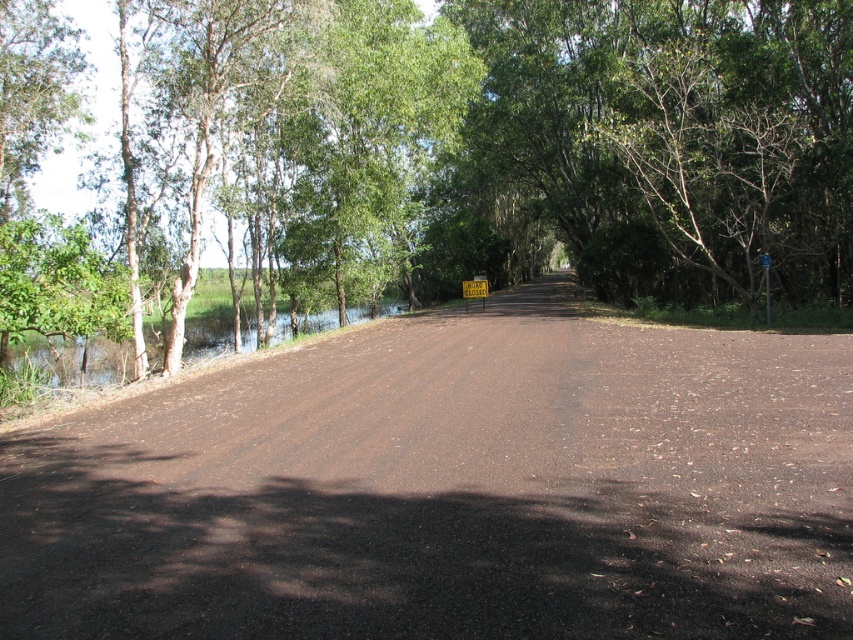
Question: Is green leafy tree at center above yellow plastic sign at center?

Choices:
 (A) no
 (B) yes

Answer: (B)

Question: Is green leafy tree at center below yellow plastic sign at center?

Choices:
 (A) no
 (B) yes

Answer: (A)

Question: Which point is closer to the camera?

Choices:
 (A) yellow plastic sign at center
 (B) green leafy tree at center

Answer: (B)

Question: Which object appears closest to the camera in this image?

Choices:
 (A) green leafy tree at center
 (B) green leafy water at left
 (C) yellow plastic sign at center

Answer: (A)

Question: Does green leafy tree at center appear under yellow plastic sign at center?

Choices:
 (A) yes
 (B) no

Answer: (B)

Question: Which of the following is the farthest from the observer?

Choices:
 (A) (468, 353)
 (B) (270, 244)

Answer: (B)